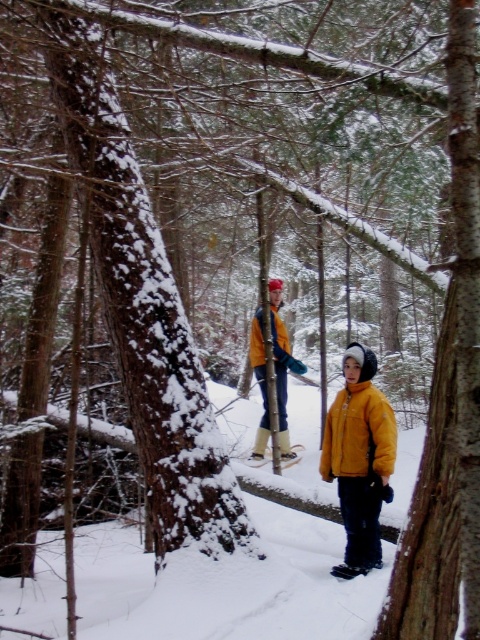
You are hiking in the winter forest and see two people on the snowy path. One is wearing a matte yellow jacket at center and the other is wearing a yellow matte jacket at center. Which jacket is lower in position?

The matte yellow jacket at center is located below the yellow matte jacket at center, so the matte yellow jacket at center is lower in position.

You are a hiker navigating a snowy path in the forest. You come across two points marked on your map at coordinates point [363,486] and point [260,436]. Which point is closer to your current position if you are standing at the starting point of the path?

Point [363,486] is closer to the viewer than point [260,436], so the closer point to your current position is point [363,486].

You are navigating a winter forest path and want to locate the matte yellow jacket at center. According to the coordinates provided, where would you look to find it?

The matte yellow jacket at center is located at point 0.717 on the x axis and 0.750 on the y axis.